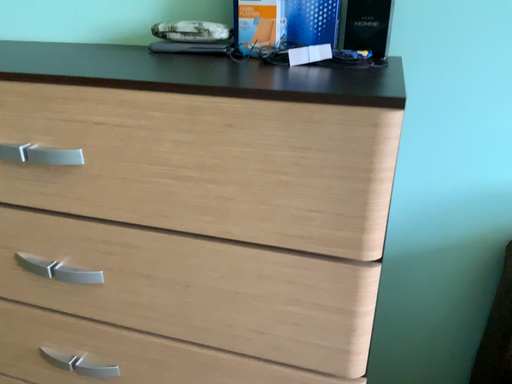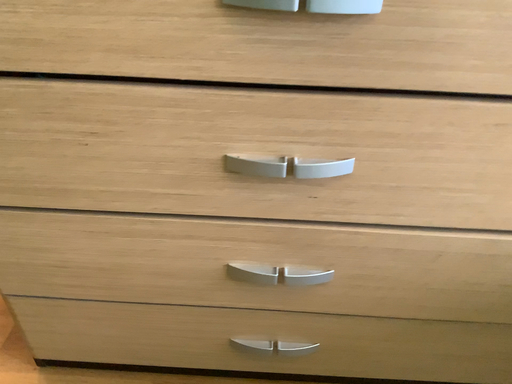
Question: How did the camera likely rotate when shooting the video?

Choices:
 (A) rotated upward
 (B) rotated downward

Answer: (B)